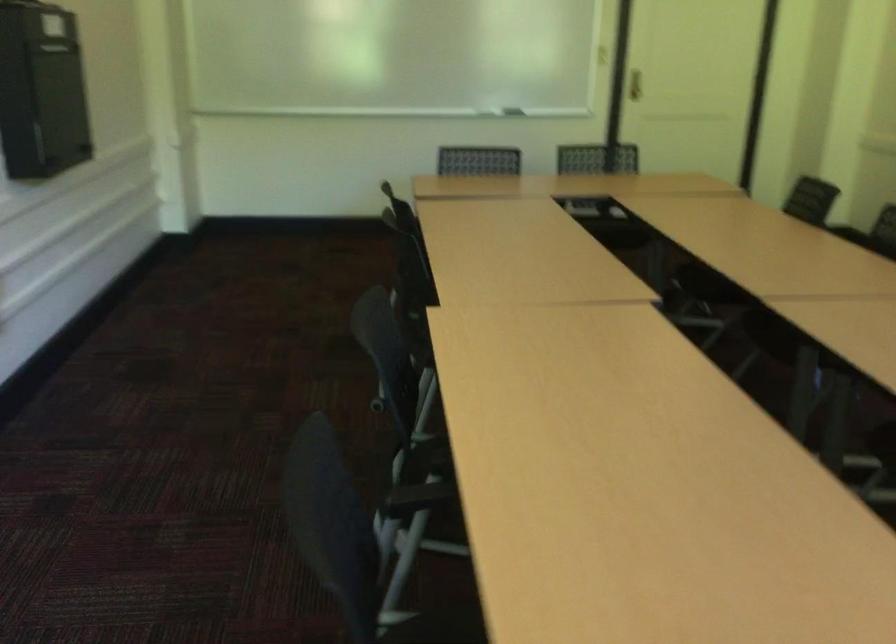
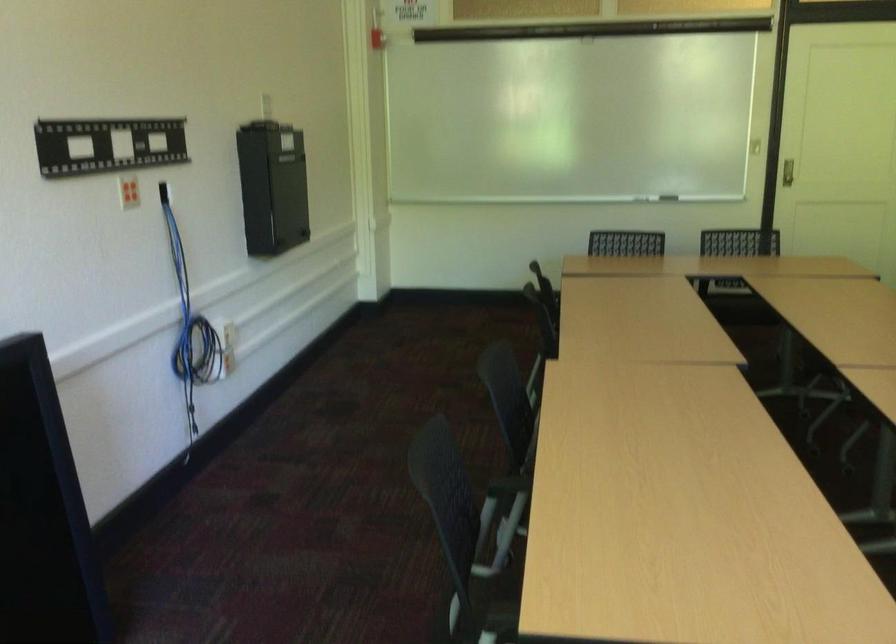
Find the pixel in the second image that matches the point at 419,491 in the first image.

(506, 486)